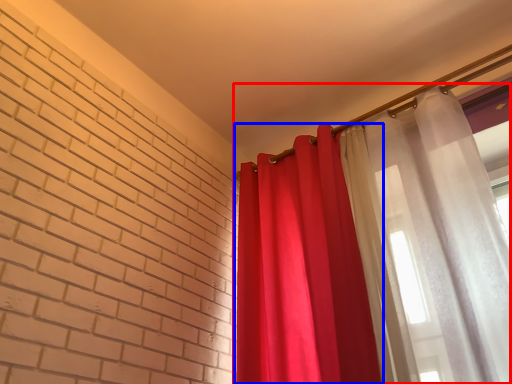
Question: Which object appears closest to the camera in this image, curtain (highlighted by a red box) or curtain (highlighted by a blue box)?

Choices:
 (A) curtain
 (B) curtain

Answer: (A)